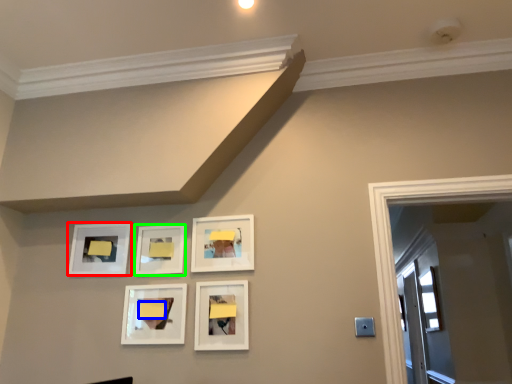
Question: Which object is positioned closest to picture frame (highlighted by a red box)? Select from lift (highlighted by a blue box) and picture frame (highlighted by a green box).

Choices:
 (A) lift
 (B) picture frame

Answer: (B)